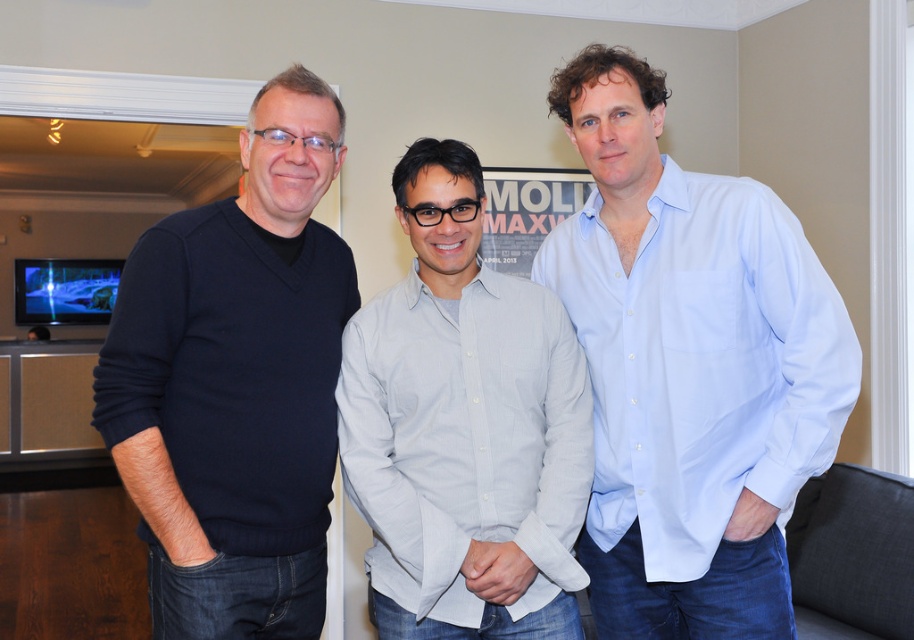
You are planning to take a photo of the group. The photographer wants to ensure that the dark blue sweater at left and the light gray cotton shirt at center are both in the frame. Based on their positions, which direction should the camera be pointed to include both?

The camera should be pointed to the left of the light gray cotton shirt at center to include the dark blue sweater at left, since the dark blue sweater at left is positioned to the left of the light gray cotton shirt at center.

You are standing in the room and see the three people. You need to place a sticker exactly at point (236, 381). Which person should you place it on?

The point (236, 381) is on the dark blue sweater at left, so you should place the sticker on the person wearing the dark blue sweater at left.